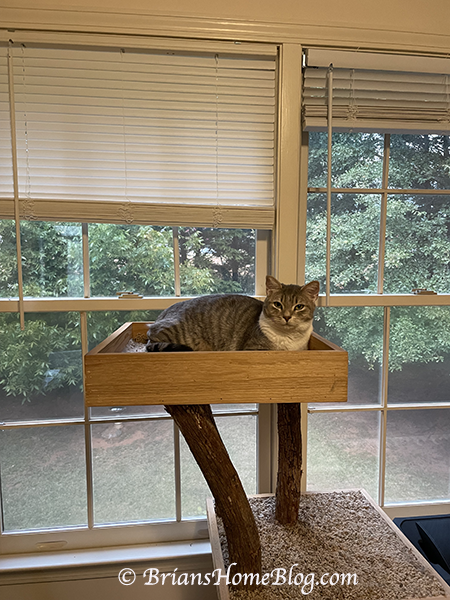
The height and width of the screenshot is (600, 450). In order to click on blinds in this screenshot , I will do `click(204, 118)`, `click(375, 80)`.